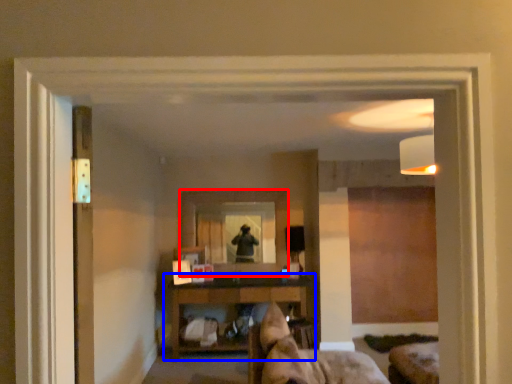
Question: Among these objects, which one is nearest to the camera, mirror (highlighted by a red box) or shelf (highlighted by a blue box)?

Choices:
 (A) mirror
 (B) shelf

Answer: (B)